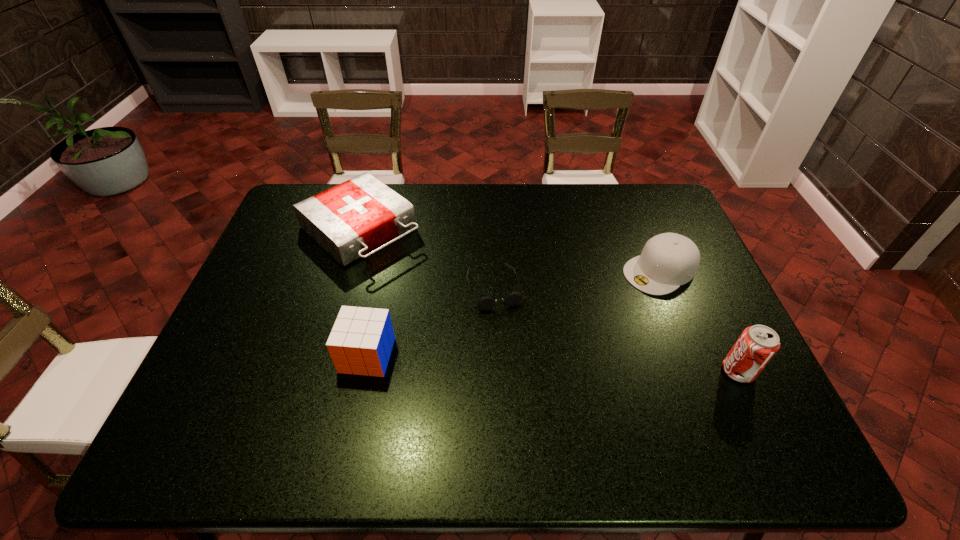
Find the location of a particular element. Image resolution: width=960 pixels, height=540 pixels. cube is located at coordinates (360, 343).

Locate an element on the screen. This screenshot has height=540, width=960. soda can is located at coordinates (757, 344).

Image resolution: width=960 pixels, height=540 pixels. In order to click on the first-aid kit in this screenshot , I will do `click(349, 220)`.

Identify the location of the shortest object. (484, 303).

You are a GUI agent. You are given a task and a screenshot of the screen. Output one action in this format:
    pyautogui.click(x=<x>, y=<y>)
    Task: Click on the third object from left to right
    
    Given the screenshot: What is the action you would take?
    (484, 303)

In order to click on cap in this screenshot , I will do `click(668, 260)`.

Image resolution: width=960 pixels, height=540 pixels. Identify the location of free space located 0.310m on the right of the second tallest object. (516, 355).

Identify the location of free space located 0.110m on the left of the tallest object. Image resolution: width=960 pixels, height=540 pixels. (677, 371).

Where is `vacant space situated 0.200m on the front side of the first-aid kit`? This screenshot has height=540, width=960. vacant space situated 0.200m on the front side of the first-aid kit is located at coordinates (441, 296).

Where is `vacant space located 0.370m on the front side of the first-aid kit`? vacant space located 0.370m on the front side of the first-aid kit is located at coordinates (482, 330).